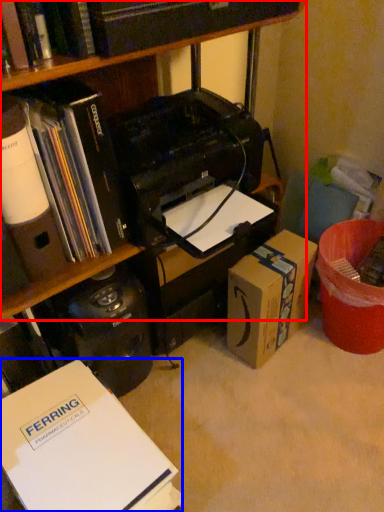
Question: Which object appears closest to the camera in this image, bookcase (highlighted by a red box) or book (highlighted by a blue box)?

Choices:
 (A) bookcase
 (B) book

Answer: (B)